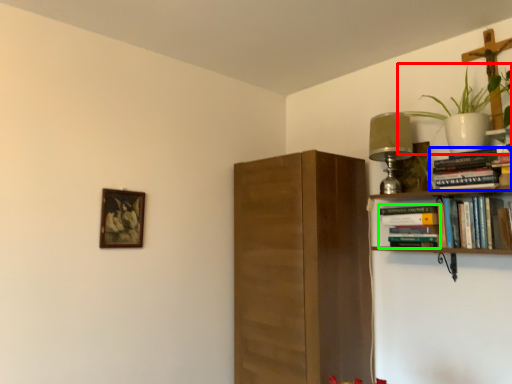
Question: Which object is the closest to the houseplant (highlighted by a red box)? Choose among these: book (highlighted by a blue box) or book (highlighted by a green box).

Choices:
 (A) book
 (B) book

Answer: (A)